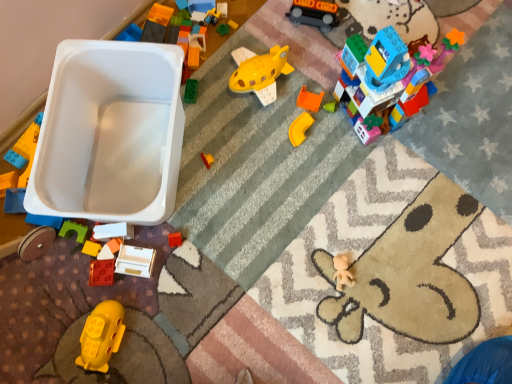
Find the location of a particular element. vacant space that's between shiny black train at upper center, arranged as the 1th toy when viewed from the top, and matte white drawer at lower center, which is counted as the 5th toy, starting from the left is located at coordinates (234, 133).